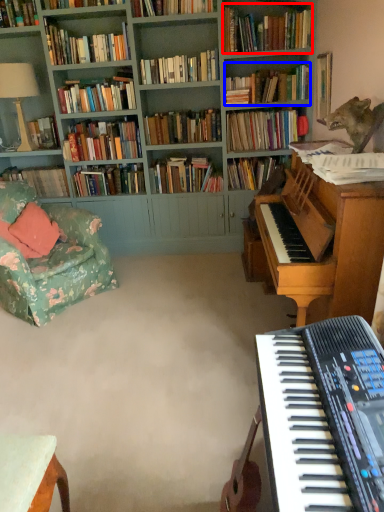
Question: Which object is further to the camera taking this photo, book (highlighted by a red box) or book (highlighted by a blue box)?

Choices:
 (A) book
 (B) book

Answer: (B)